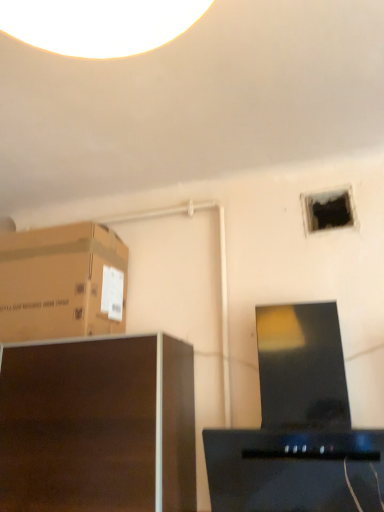
Question: Considering the relative positions of dark wood cabinet at lower left and black glossy desktop computer at center in the image provided, is dark wood cabinet at lower left to the left of black glossy desktop computer at center from the viewer's perspective?

Choices:
 (A) yes
 (B) no

Answer: (A)

Question: From a real-world perspective, is dark wood cabinet at lower left located beneath black glossy desktop computer at center?

Choices:
 (A) yes
 (B) no

Answer: (A)

Question: Is dark wood cabinet at lower left positioned in front of black glossy desktop computer at center?

Choices:
 (A) no
 (B) yes

Answer: (A)

Question: Does dark wood cabinet at lower left turn towards black glossy desktop computer at center?

Choices:
 (A) yes
 (B) no

Answer: (B)

Question: From the image's perspective, does dark wood cabinet at lower left appear higher than black glossy desktop computer at center?

Choices:
 (A) no
 (B) yes

Answer: (A)

Question: Considering the positions of dark wood cabinet at lower left and black glossy desktop computer at center in the image, is dark wood cabinet at lower left bigger or smaller than black glossy desktop computer at center?

Choices:
 (A) small
 (B) big

Answer: (B)

Question: Relative to black glossy desktop computer at center, is dark wood cabinet at lower left in front or behind?

Choices:
 (A) front
 (B) behind

Answer: (B)

Question: Does point (4, 424) appear closer or farther from the camera than point (380, 481)?

Choices:
 (A) farther
 (B) closer

Answer: (A)

Question: Is dark wood cabinet at lower left situated inside black glossy desktop computer at center or outside?

Choices:
 (A) outside
 (B) inside

Answer: (A)

Question: From a real-world perspective, is black matte hole at upper right above or below black glossy desktop computer at center?

Choices:
 (A) above
 (B) below

Answer: (A)

Question: Does point tap(340, 225) appear closer or farther from the camera than point tap(299, 471)?

Choices:
 (A) closer
 (B) farther

Answer: (B)

Question: Considering the positions of black matte hole at upper right and black glossy desktop computer at center in the image, is black matte hole at upper right wider or thinner than black glossy desktop computer at center?

Choices:
 (A) thin
 (B) wide

Answer: (A)

Question: Which is correct: black matte hole at upper right is inside black glossy desktop computer at center, or outside of it?

Choices:
 (A) inside
 (B) outside

Answer: (B)

Question: Would you say black glossy desktop computer at center is to the left or to the right of black matte hole at upper right in the picture?

Choices:
 (A) right
 (B) left

Answer: (B)

Question: Is black glossy desktop computer at center taller or shorter than black matte hole at upper right?

Choices:
 (A) tall
 (B) short

Answer: (A)